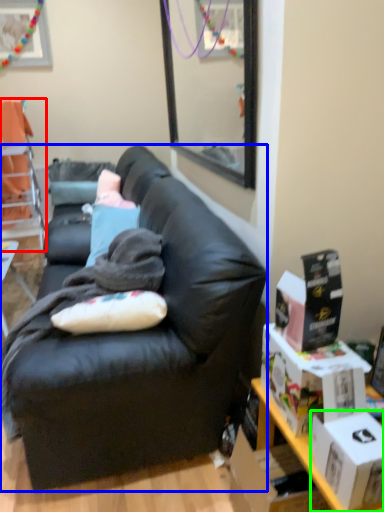
Question: Estimate the real-world distances between objects in this image. Which object is farther from chair (highlighted by a red box), studio couch (highlighted by a blue box) or box (highlighted by a green box)?

Choices:
 (A) studio couch
 (B) box

Answer: (B)